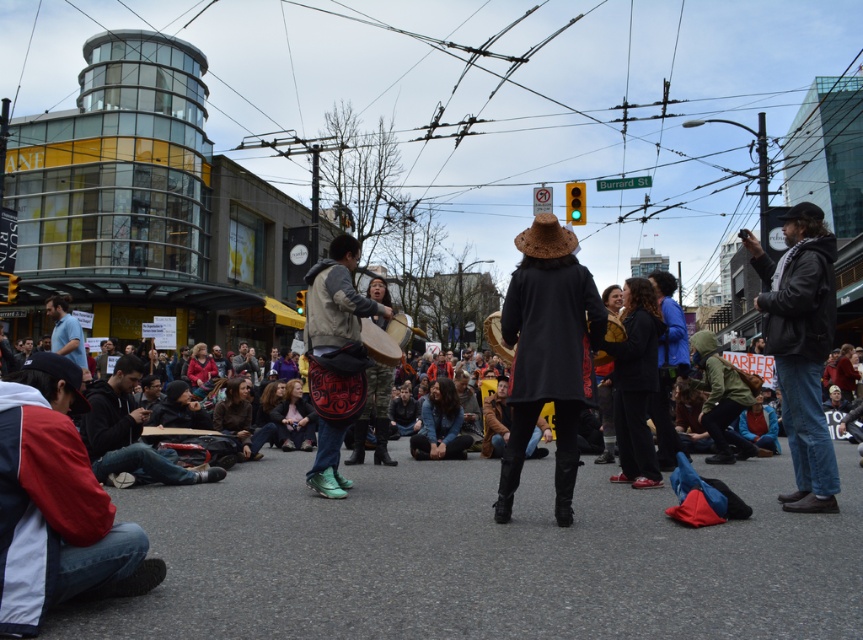
Is black matte coat at center thinner than wooden drum at center?

Yes, black matte coat at center is thinner than wooden drum at center.

Which is above, black matte coat at center or wooden drum at center?

wooden drum at center is above.

Between point (567, 525) and point (366, 348), which one is positioned in front?

Positioned in front is point (567, 525).

This screenshot has height=640, width=863. In order to click on black matte coat at center in this screenshot , I will do `click(547, 353)`.

Does black matte coat at center appear on the left side of leather drum at center?

Incorrect, black matte coat at center is not on the left side of leather drum at center.

Does point (550, 221) come behind point (336, 426)?

No, it is in front of (336, 426).

Between point (583, 292) and point (336, 307), which one is positioned in front?

Point (583, 292) is more forward.

Identify the location of black matte coat at center. (547, 353).

Is black matte coat at center smaller than denim jacket at right?

Correct, black matte coat at center occupies less space than denim jacket at right.

Is the position of black matte coat at center more distant than that of denim jacket at right?

No, it is in front of denim jacket at right.

Does point (570, 260) lie in front of point (804, 237)?

Yes, it is in front of point (804, 237).

Where is `black matte coat at center`? This screenshot has width=863, height=640. black matte coat at center is located at coordinates (547, 353).